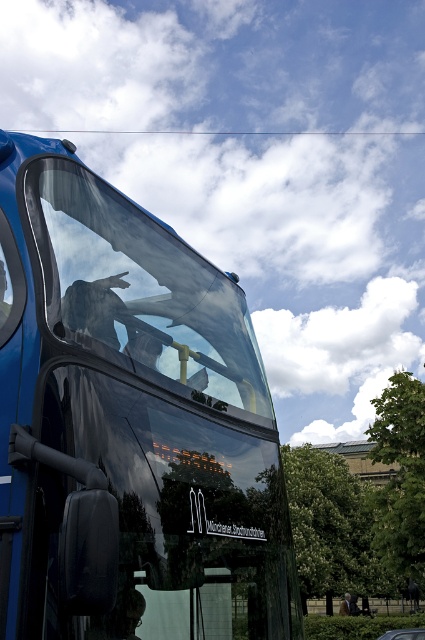
Does shiny blue bus at center have a greater width compared to transparent glass windshield at upper center?

Yes.

Can you confirm if shiny blue bus at center is shorter than transparent glass windshield at upper center?

No.

At what (x,y) coordinates should I click in order to perform the action: click on shiny blue bus at center. Please return your answer as a coordinate pair (x, y). This screenshot has width=425, height=640. Looking at the image, I should click on pos(129,424).